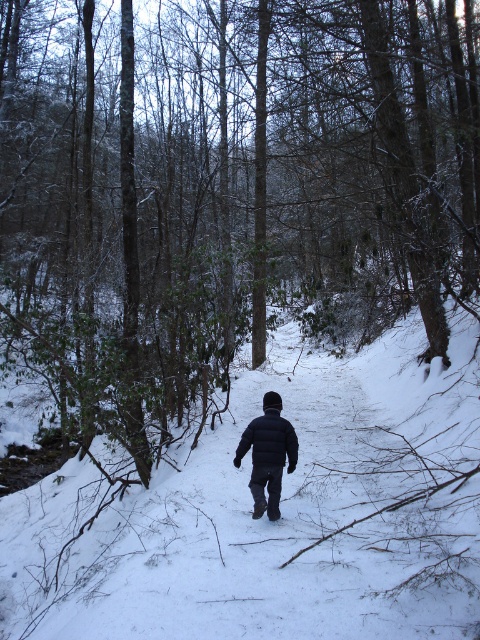
You are a hiker who just arrived at the forest path. You see a dark blue puffy jacket at center and a matte black jacket at center. Which jacket is higher up on the person?

The dark blue puffy jacket at center is located above the matte black jacket at center, so the dark blue puffy jacket at center is higher up on the person.

You are standing at the point marked by the coordinates point (280, 513) in the winter forest scene. What is the primary substance you are standing on?

The point (280, 513) corresponds to white powdery snow at center, so you are standing on white powdery snow at center.

You are a photographer trying to capture the dark blue puffy jacket at center and the white powdery snow at center in the same frame. Based on their positions, which object should you adjust your camera to focus on first to ensure both are in the frame?

The dark blue puffy jacket at center should be focused on first since the white powdery snow at center is to its right side, so adjusting focus on the jacket ensures the snow remains in the frame as well.